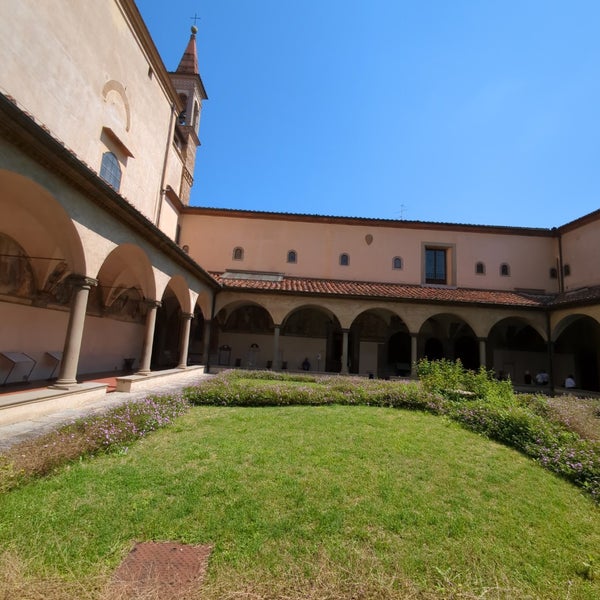
Identify the location of pillar. This screenshot has width=600, height=600. (67, 342).